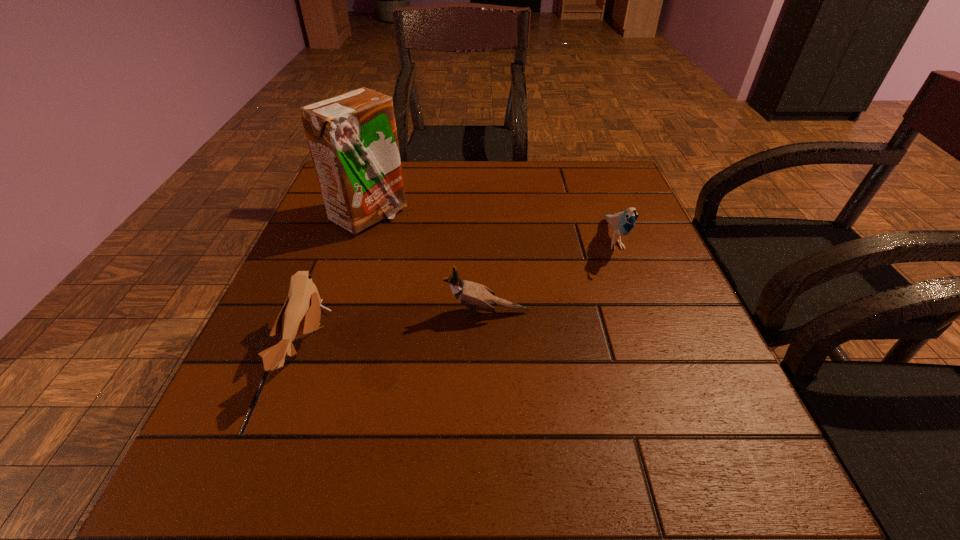
This screenshot has height=540, width=960. Find the location of `free spot that satisfies the following two spatial constraints: 1. at the face of the rightmost object; 2. at the beak of the leftmost bird`. free spot that satisfies the following two spatial constraints: 1. at the face of the rightmost object; 2. at the beak of the leftmost bird is located at coordinates (654, 347).

Where is `free space that satisfies the following two spatial constraints: 1. at the face of the rightmost object; 2. at the beak of the leftmost bird`? This screenshot has height=540, width=960. free space that satisfies the following two spatial constraints: 1. at the face of the rightmost object; 2. at the beak of the leftmost bird is located at coordinates pyautogui.click(x=654, y=347).